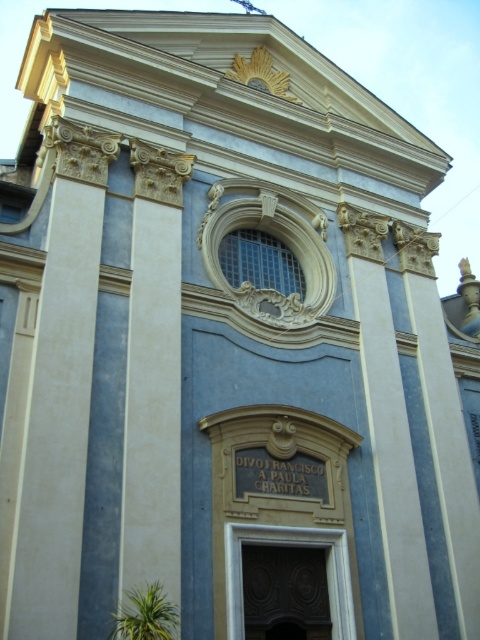
Question: Can you confirm if white plaster column at left is smaller than dark wood carved door at center?

Choices:
 (A) yes
 (B) no

Answer: (B)

Question: Which point is farther to the camera?

Choices:
 (A) (135, 486)
 (B) (313, 564)

Answer: (B)

Question: In this image, where is white plaster column at left located relative to dark wood carved door at center?

Choices:
 (A) below
 (B) above

Answer: (B)

Question: Among these objects, which one is farthest from the camera?

Choices:
 (A) dark wood carved door at center
 (B) white plaster column at left

Answer: (A)

Question: Among these objects, which one is farthest from the camera?

Choices:
 (A) dark wood carved door at center
 (B) white plaster column at left

Answer: (A)

Question: Does white plaster column at left come in front of dark wood carved door at center?

Choices:
 (A) no
 (B) yes

Answer: (B)